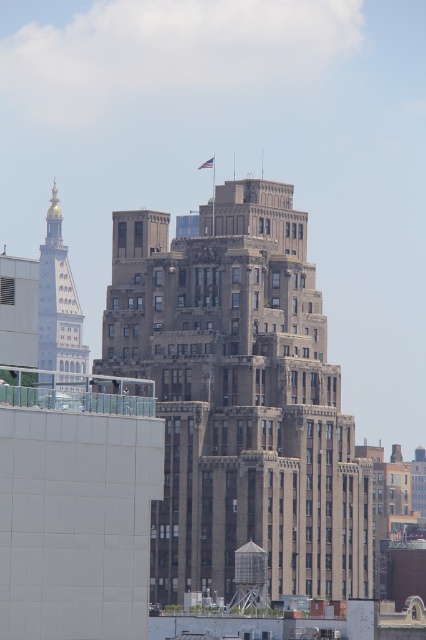
You are standing at the center of the city square and want to take a photo of the brown stone building at center. According to the scene description, where should you position yourself to capture the entire building in your camera frame?

The brown stone building at center is positioned at point (239,397), so you should position yourself directly in front of it to ensure the entire structure fits within your camera frame.